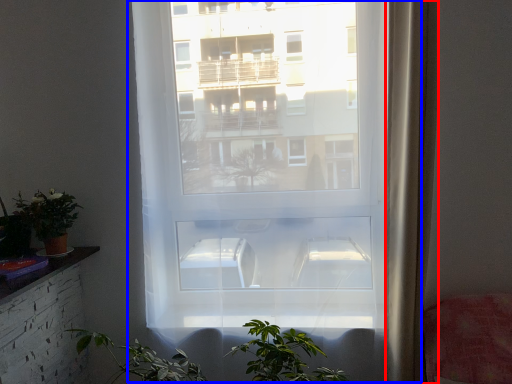
Question: Which object appears closest to the camera in this image, curtain (highlighted by a red box) or window (highlighted by a blue box)?

Choices:
 (A) curtain
 (B) window

Answer: (A)